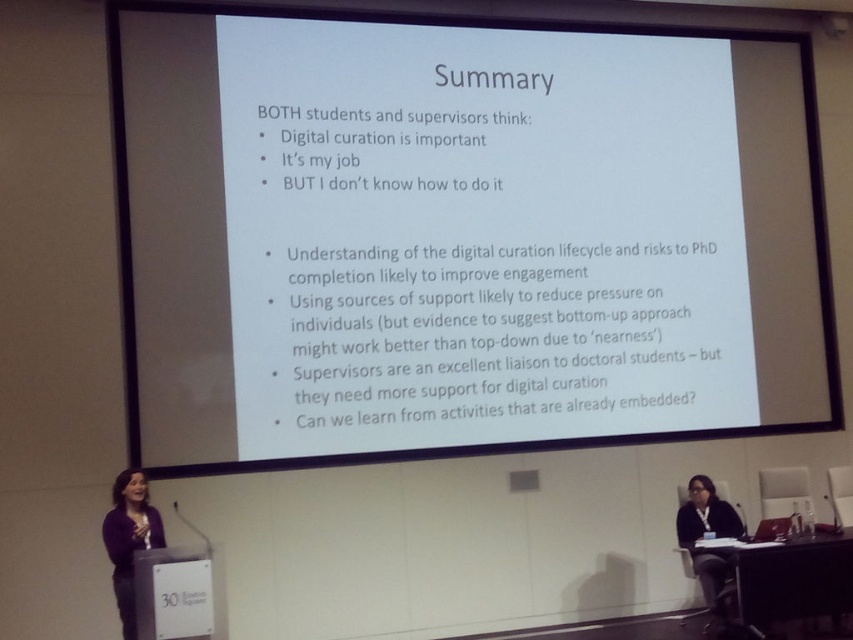
What do you see at coordinates (129, 540) in the screenshot?
I see `dark purple sweater at lower left` at bounding box center [129, 540].

The image size is (853, 640). Describe the element at coordinates (129, 540) in the screenshot. I see `dark purple sweater at lower left` at that location.

Identify the location of dark purple sweater at lower left. The image size is (853, 640). (129, 540).